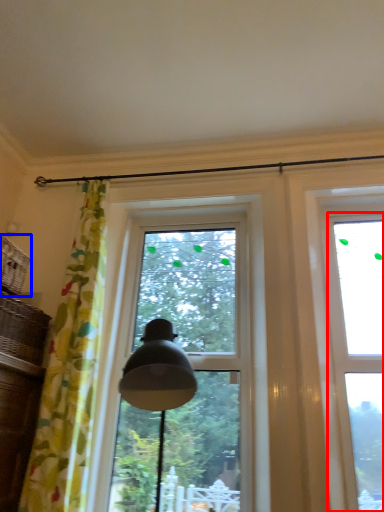
Question: Which object is closer to the camera taking this photo, window (highlighted by a red box) or basket (highlighted by a blue box)?

Choices:
 (A) window
 (B) basket

Answer: (B)